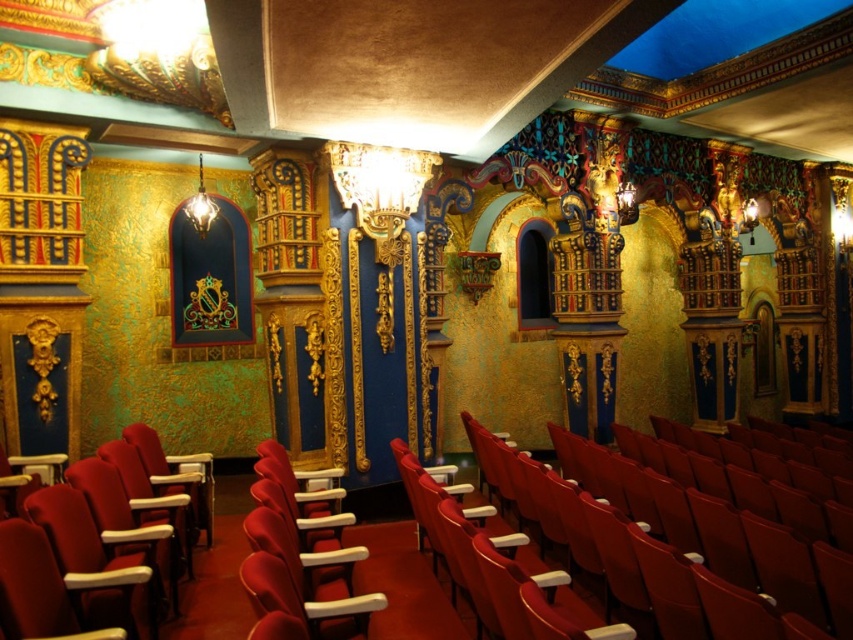
Between matte red seat at center and velvet red seat at left, which one is positioned lower?

matte red seat at center

Who is shorter, matte red seat at center or velvet red seat at left?

matte red seat at center is shorter.

Who is more forward, (498, 538) or (131, 444)?

Point (498, 538) is in front.

Locate an element on the screen. matte red seat at center is located at coordinates (648, 545).